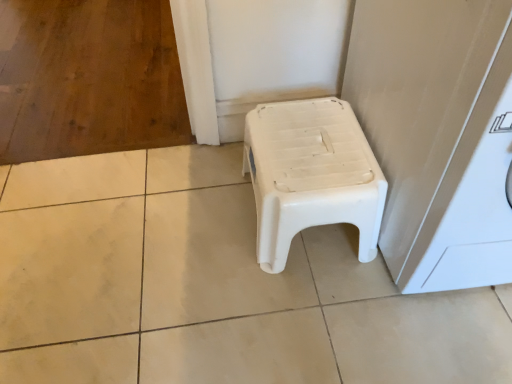
The width and height of the screenshot is (512, 384). What are the coordinates of `free space above white plastic stool at center (from a real-world perspective)` in the screenshot? It's located at (308, 145).